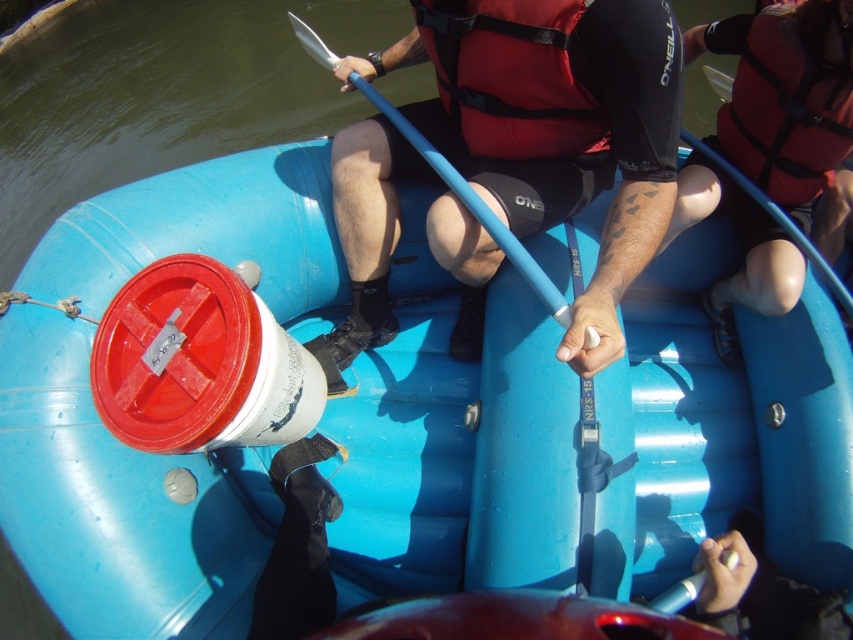
Can you confirm if red life vest at upper right is bigger than red nylon life jacket at upper right?

Correct, red life vest at upper right is larger in size than red nylon life jacket at upper right.

Between point (769, 145) and point (762, 140), which one is positioned behind?

The point (762, 140) is more distant.

Who is more forward, (817, 184) or (746, 140)?

Point (817, 184) is more forward.

At what (x,y) coordinates should I click in order to perform the action: click on red life vest at upper right. Please return your answer as a coordinate pair (x, y). The width and height of the screenshot is (853, 640). Looking at the image, I should click on (784, 97).

Between red life vest at upper right and red nylon life jacket at center, which one has less height?

red nylon life jacket at center

Between point (792, 96) and point (537, 24), which one is positioned behind?

Positioned behind is point (792, 96).

Which is in front, point (732, 346) or point (575, 120)?

Point (575, 120) is in front.

The width and height of the screenshot is (853, 640). Find the location of `red life vest at upper right`. red life vest at upper right is located at coordinates (784, 97).

Can you confirm if matte blue paddle at center is positioned above red nylon life jacket at center?

Incorrect, matte blue paddle at center is not positioned above red nylon life jacket at center.

Is matte blue paddle at center closer to camera compared to red nylon life jacket at center?

Yes, it is.

Which is behind, point (357, 220) or point (511, 81)?

The point (357, 220) is behind.

Where is `matte blue paddle at center`? The height and width of the screenshot is (640, 853). matte blue paddle at center is located at coordinates (573, 134).